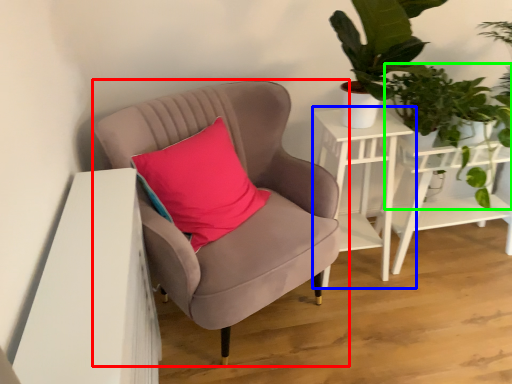
Question: Estimate the real-world distances between objects in this image. Which object is farther from chair (highlighted by a red box), table (highlighted by a blue box) or vegetation (highlighted by a green box)?

Choices:
 (A) table
 (B) vegetation

Answer: (B)